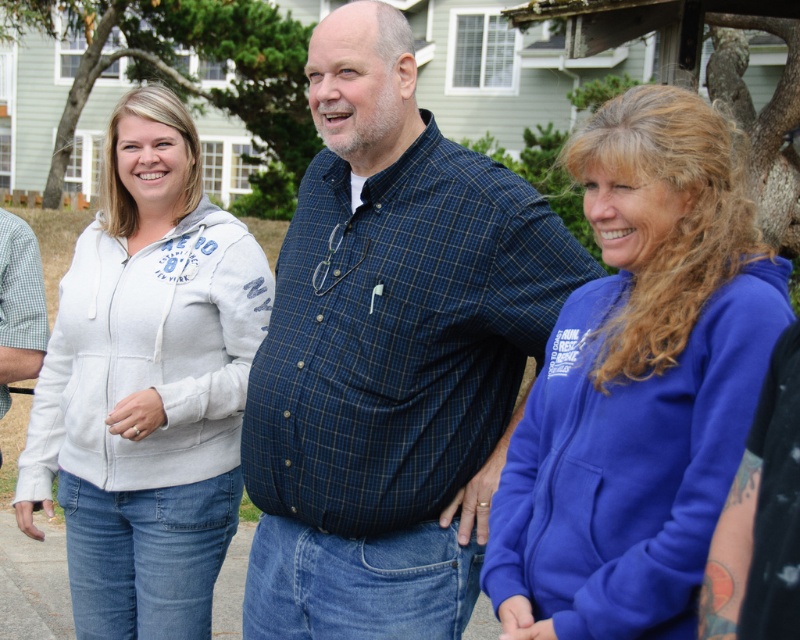
You are a photographer standing 5 meters away from the light gray fleece jacket at center. You want to take a photo of the jacket. Is the jacket within your camera range if your camera can focus up to 4 meters?

The light gray fleece jacket at center is 3.22 meters away from the camera, which is within the camera range of up to 4 meters. Therefore, the jacket can be focused on by the camera.

Looking at this image, you are a delivery person needing to place a package between the blue plaid shirt at center and the white gingham shirt at left. The package requires 5 feet of space. Can you fit it there?

The distance between the blue plaid shirt at center and the white gingham shirt at left is 4.92 feet, which is slightly less than the required 5 feet. Therefore, the package cannot be placed there.

You are taking a photo of two points in the scene. The first point is at coordinate point (376, 403) and the second is at point (40, 620). Which point will appear larger in your photo?

Point (376, 403) will appear larger in the photo because it is closer to the camera than point (40, 620).